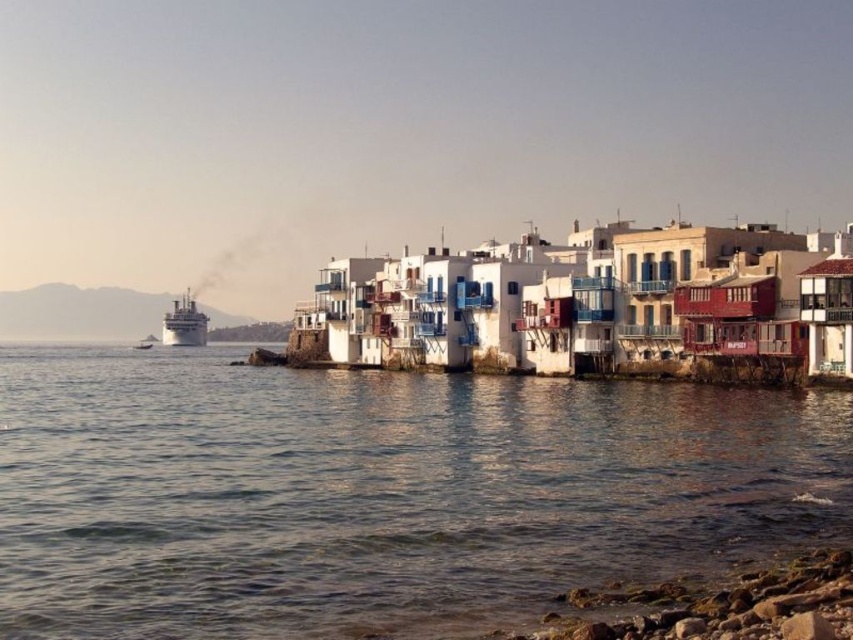
Consider the image. You are a tourist standing at the edge of the water in this coastal scene. You want to take a photo of the white painted wood houses at center while staying in the clear water at lower left. Will you be able to see the houses in your camera view if you stay in the water?

The clear water at lower left is to the left of white painted wood houses at center, so if you stay in the clear water at lower left, you can still see the white painted wood houses at center as they are positioned to the right of your current location.

You are a tour guide planning a boat tour departing from the coast in the image. The boat you will use can only navigate through spaces that are at least 200 meters wide. Based on the scene, can the boat safely pass between the clear water at lower left and the shiny silver cruise ship at left?

The clear water at lower left and the shiny silver cruise ship at left are 229.04 meters apart from each other, which is wider than the boat tour requirement of 200 meters. Therefore, the boat can safely pass between them.